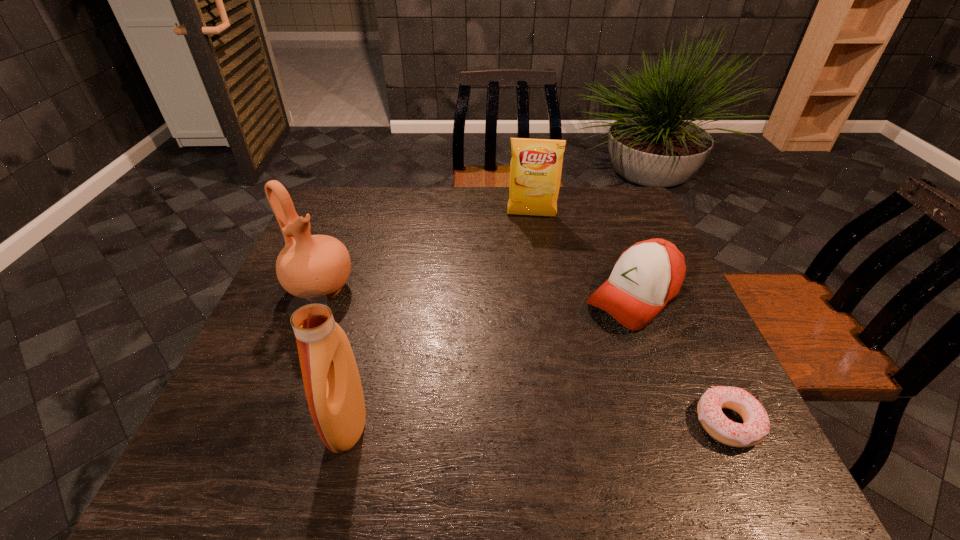
Find the location of a particular element. The image size is (960, 540). detergent located at the near edge is located at coordinates (332, 383).

This screenshot has width=960, height=540. Identify the location of doughnut that is at the near edge. (756, 425).

The height and width of the screenshot is (540, 960). In order to click on object at the left edge in this screenshot , I will do pos(308,262).

Identify the location of doughnut that is positioned at the right edge. (756, 425).

At what (x,y) coordinates should I click in order to perform the action: click on baseball cap located in the right edge section of the desktop. Please return your answer as a coordinate pair (x, y). This screenshot has height=540, width=960. Looking at the image, I should click on (647, 276).

Where is `object situated at the near right corner`? The height and width of the screenshot is (540, 960). object situated at the near right corner is located at coordinates (756, 425).

The width and height of the screenshot is (960, 540). Find the location of `free space at the far edge`. free space at the far edge is located at coordinates tap(367, 224).

Locate an element on the screen. The image size is (960, 540). vacant space at the right edge of the desktop is located at coordinates (681, 355).

This screenshot has width=960, height=540. What are the coordinates of `free space at the near left corner` in the screenshot? It's located at (268, 400).

In order to click on empty location between the crisp (potato chip) and the second shortest object in this screenshot , I will do `click(583, 256)`.